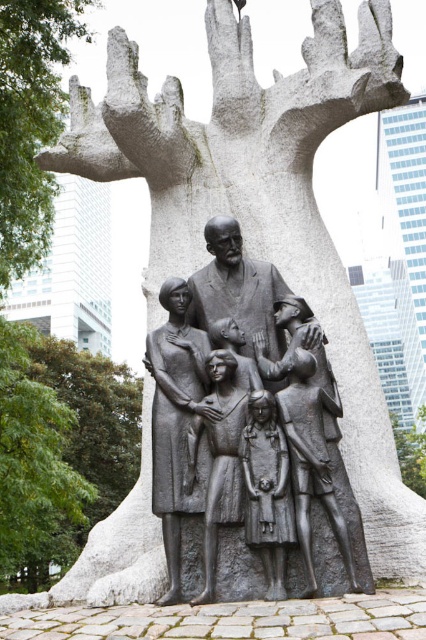
Question: Is bronze sculpture of family at center further to camera compared to gray stone tree trunk at center?

Choices:
 (A) yes
 (B) no

Answer: (B)

Question: Which object is positioned closest to the bronze sculpture of family at center?

Choices:
 (A) gray stone tree trunk at center
 (B) green leafy tree at lower left

Answer: (B)

Question: Does bronze sculpture of family at center lie behind gray stone tree trunk at center?

Choices:
 (A) no
 (B) yes

Answer: (A)

Question: Which point is farther to the camera?

Choices:
 (A) (26, 371)
 (B) (412, 433)
 (C) (195, 307)
 (D) (14, 8)

Answer: (B)

Question: Is gray stone tree trunk at upper center to the left of green leafy tree at lower left from the viewer's perspective?

Choices:
 (A) yes
 (B) no

Answer: (B)

Question: Estimate the real-world distances between objects in this image. Which object is farther from the green leafy tree at lower left?

Choices:
 (A) bronze sculpture of family at center
 (B) gray stone tree trunk at center
 (C) gray stone tree trunk at upper center

Answer: (B)